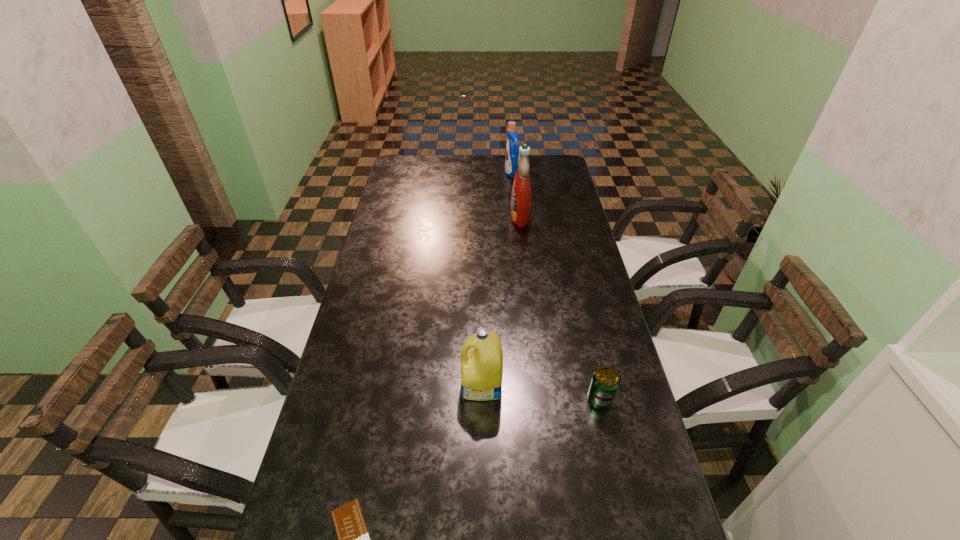
Image resolution: width=960 pixels, height=540 pixels. I want to click on vacant space at the left edge of the desktop, so [x=361, y=283].

The width and height of the screenshot is (960, 540). In the image, there is a desktop. What are the coordinates of `vacant space at the right edge` in the screenshot? It's located at (544, 249).

Find the location of `vacant space that's between the beer can and the farthest object`. vacant space that's between the beer can and the farthest object is located at coordinates (556, 287).

This screenshot has width=960, height=540. I want to click on vacant space that is in between the farthest object and the nearest detergent, so click(497, 279).

Where is `unoccupied area between the tallest object and the leftmost detergent`? This screenshot has width=960, height=540. unoccupied area between the tallest object and the leftmost detergent is located at coordinates (501, 301).

Identify the location of vacant area that lies between the rightmost object and the farthest object. (556, 287).

Find the location of a particular element. empty space between the beer can and the farthest detergent is located at coordinates (556, 287).

Locate which object is the third closest to the second farthest detergent. Please provide its 2D coordinates. Your answer should be formatted as a tuple, i.e. [(x, y)], where the tuple contains the x and y coordinates of a point satisfying the conditions above.

[(605, 382)]

Where is `object that is the second closest one to the second farthest detergent`? This screenshot has height=540, width=960. object that is the second closest one to the second farthest detergent is located at coordinates (482, 366).

At what (x,y) coordinates should I click in order to perform the action: click on detergent that is the second closest to the shortest object. Please return your answer as a coordinate pair (x, y). This screenshot has height=540, width=960. Looking at the image, I should click on (521, 190).